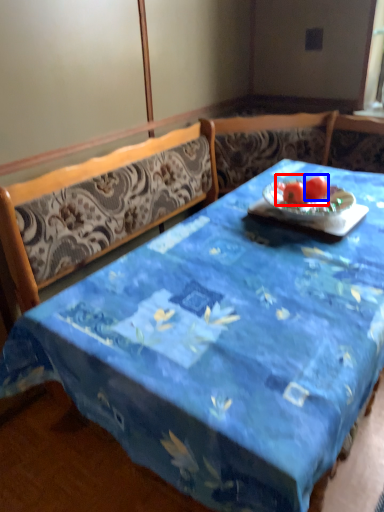
Question: Which object appears farthest to the camera in this image, fruit (highlighted by a red box) or tomato (highlighted by a blue box)?

Choices:
 (A) fruit
 (B) tomato

Answer: (B)